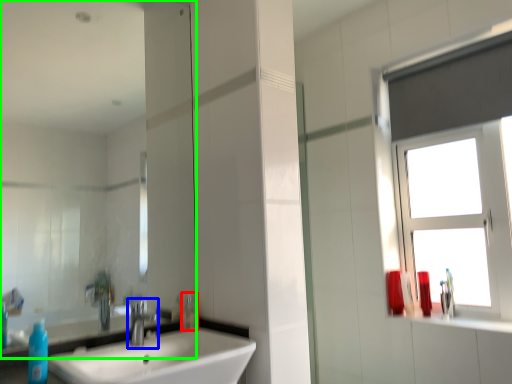
Question: Which object is positioned farthest from toiletry (highlighted by a red box)? Select from tap (highlighted by a blue box) and mirror (highlighted by a green box).

Choices:
 (A) tap
 (B) mirror

Answer: (B)